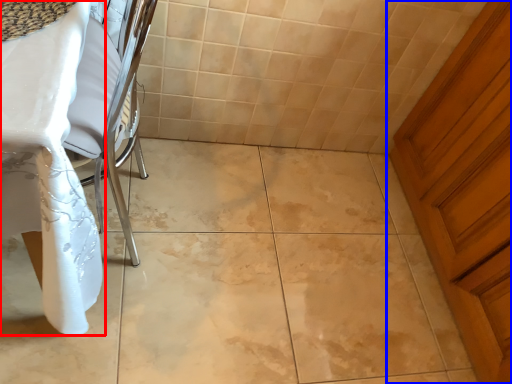
Question: Which object appears closest to the camera in this image, table (highlighted by a red box) or door (highlighted by a blue box)?

Choices:
 (A) table
 (B) door

Answer: (A)